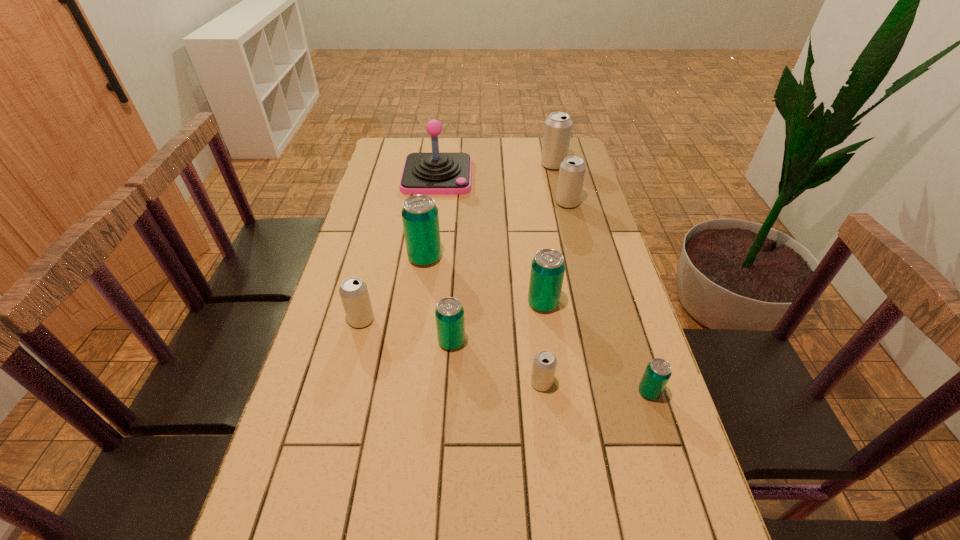
Locate an element on the screen. The image size is (960, 540). joystick is located at coordinates (435, 173).

Find the location of a particular element. the farthest beer can is located at coordinates (557, 131).

This screenshot has height=540, width=960. I want to click on the farthest white beer can, so click(x=557, y=131).

Where is `the seventh beer can from right to left`? The height and width of the screenshot is (540, 960). the seventh beer can from right to left is located at coordinates (420, 217).

This screenshot has height=540, width=960. I want to click on the fourth farthest object, so click(420, 217).

What are the coordinates of `the seventh nearest object` in the screenshot? It's located at (572, 170).

Where is `the second farthest white beer can`? Image resolution: width=960 pixels, height=540 pixels. the second farthest white beer can is located at coordinates (572, 170).

I want to click on the third teal beer can from left to right, so click(548, 267).

Where is `the third nearest teal beer can`? the third nearest teal beer can is located at coordinates (548, 267).

Locate an element on the screen. The width and height of the screenshot is (960, 540). the third biggest teal beer can is located at coordinates (449, 313).